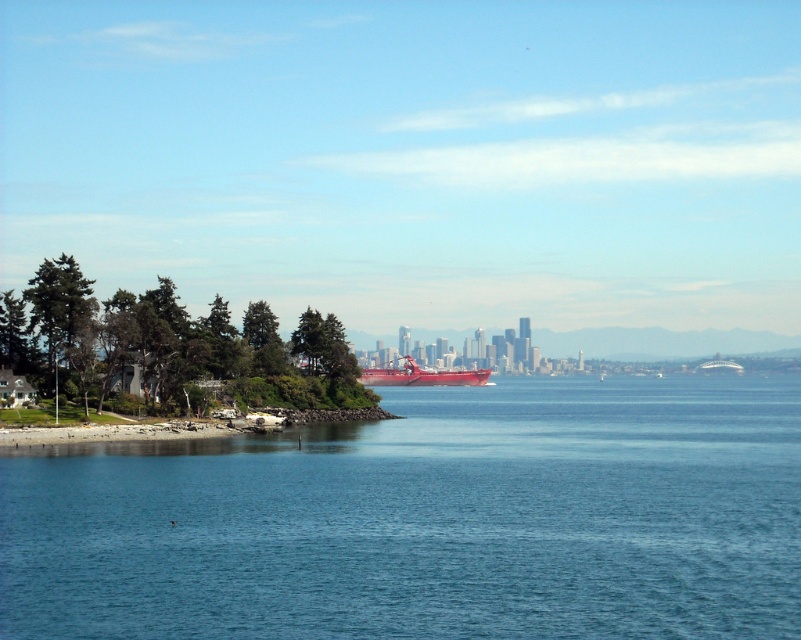
You are standing at the point marked with coordinates point [429,520] in the coastal scene. What is the immediate environment around you?

The point [429,520] corresponds to blue water at lower center, so you are surrounded by calm, deep blue waters reflecting light and creating a tranquil atmosphere.

You are standing on the rocky shoreline and want to reach the shiny red boat at center. Which direction should you move relative to the blue water at lower center?

You should move to the left of the blue water at lower center to reach the shiny red boat at center since the blue water at lower center is positioned on the right side of the shiny red boat at center.

You are a boat operator who needs to navigate a 150 feet long cargo ship through the coastal area shown in the image. The cargo ship requires a minimum of 200 feet of clearance between the blue water at lower center and the shiny red boat at center to safely pass. Based on the scene description, do you think there is enough space for the cargo ship to pass safely?

The blue water at lower center and the shiny red boat at center are 179.11 feet apart, which is less than the required 200 feet of clearance. Therefore, there is not enough space for the cargo ship to pass safely.